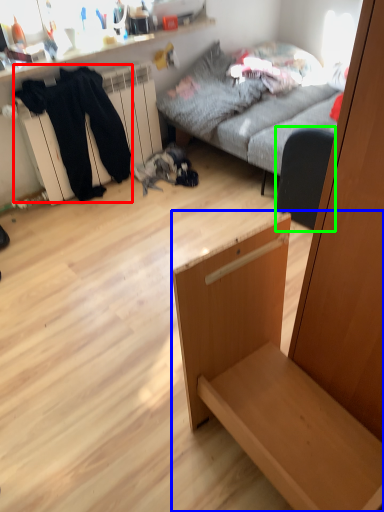
Question: Which object is the farthest from clothing (highlighted by a red box)? Choose among these: furniture (highlighted by a blue box) or armchair (highlighted by a green box).

Choices:
 (A) furniture
 (B) armchair

Answer: (A)